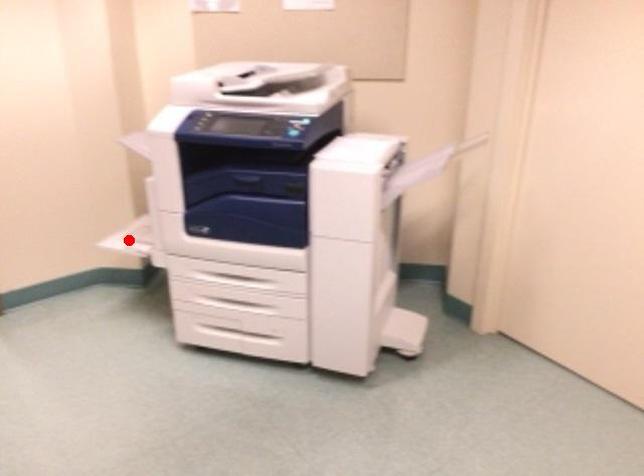
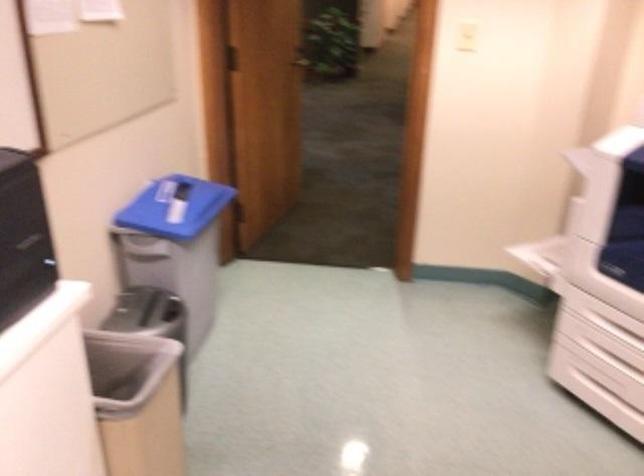
Locate, in the second image, the point that corresponds to the highlighted location in the first image.

(538, 255)